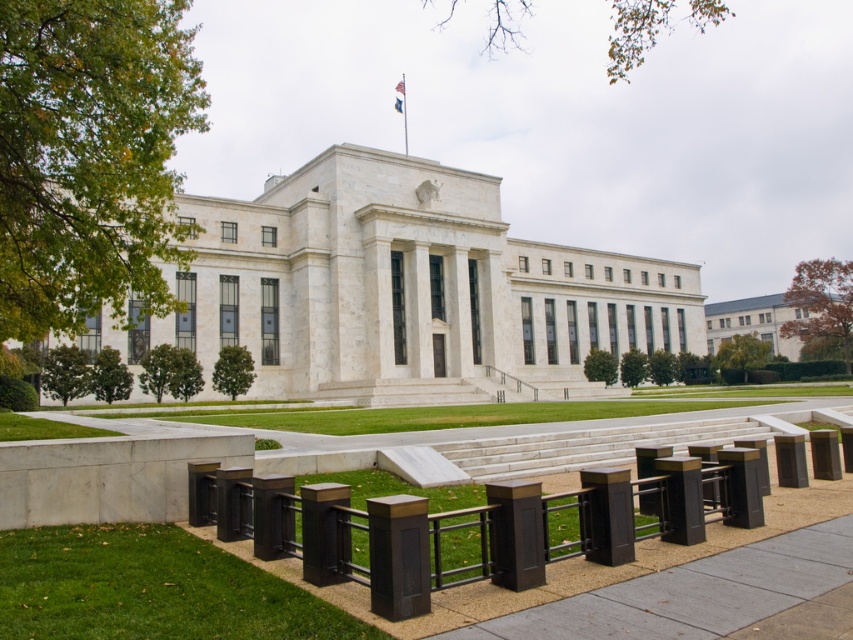
You are standing in front of the grand neoclassical building and see two posts in the center area. Which post is closer to you, the matte brown post at center or the matte black post at center?

The matte brown post at center is closer to the viewer than the matte black post at center.

You are standing in front of the building and want to walk from the green grass at lower left to the matte black post at center. Which direction should you move relative to the post?

You should move to the left of the matte black post at center to reach the green grass at lower left since the green grass at lower left is located to the left side of the matte black post at center.

You are a maintenance worker needing to place a 10 feet long hose from the green grass at lower left to the matte black post at center. Can the hose reach the post without moving it?

The distance between the green grass at lower left and the matte black post at center is 8.05 feet, so the 10 feet long hose can easily reach the post without moving it.